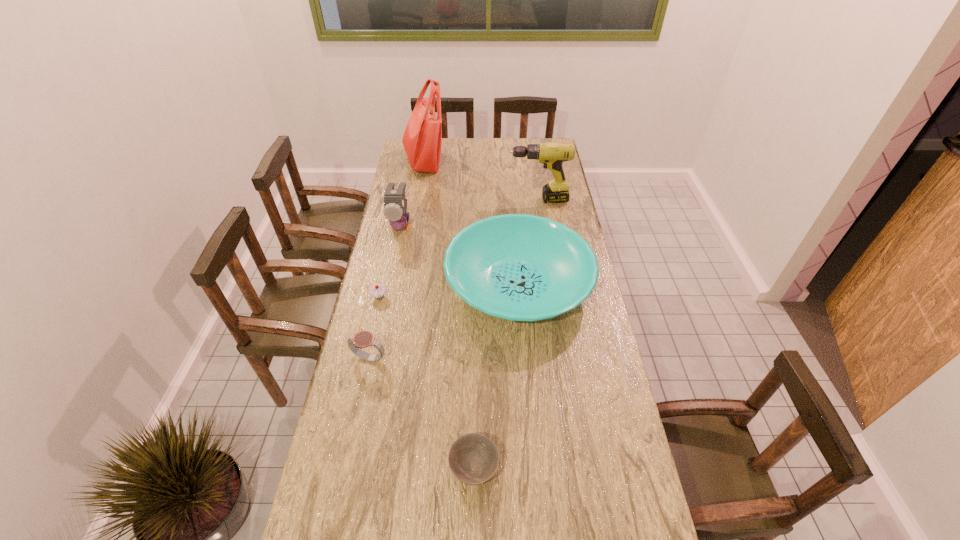
You are a GUI agent. You are given a task and a screenshot of the screen. Output one action in this format:
    pyautogui.click(x=<x>, y=<y>)
    Task: Click on the free space located on the front-facing side of the farthest object
    Image resolution: width=960 pixels, height=540 pixels.
    Given the screenshot: What is the action you would take?
    pyautogui.click(x=464, y=161)

Locate an element on the screen. The width and height of the screenshot is (960, 540). vacant area located 0.250m on the handle side of the second farthest object is located at coordinates (450, 200).

At what (x,y) coordinates should I click in order to perform the action: click on vacant space situated on the handle side of the second farthest object. Please return your answer as a coordinate pair (x, y). Looking at the image, I should click on (435, 200).

You are a GUI agent. You are given a task and a screenshot of the screen. Output one action in this format:
    pyautogui.click(x=<x>, y=<y>)
    Task: Click on the vacant space located on the handle side of the second farthest object
    
    Given the screenshot: What is the action you would take?
    pyautogui.click(x=428, y=200)

Identify the location of vacant region located 0.090m at the beak of the bird. The height and width of the screenshot is (540, 960). (395, 258).

Where is `free location located 0.120m on the back of the dish`? The image size is (960, 540). free location located 0.120m on the back of the dish is located at coordinates (513, 220).

The image size is (960, 540). I want to click on vacant area located on the front of the second nearest object, so click(352, 441).

Where is `blank area located 0.110m on the back of the cupcake`? Image resolution: width=960 pixels, height=540 pixels. blank area located 0.110m on the back of the cupcake is located at coordinates (385, 269).

Find the location of a particular element. This screenshot has height=540, width=960. vacant space situated on the right of the nearest object is located at coordinates (558, 470).

The image size is (960, 540). Identify the location of object that is at the far edge. (422, 139).